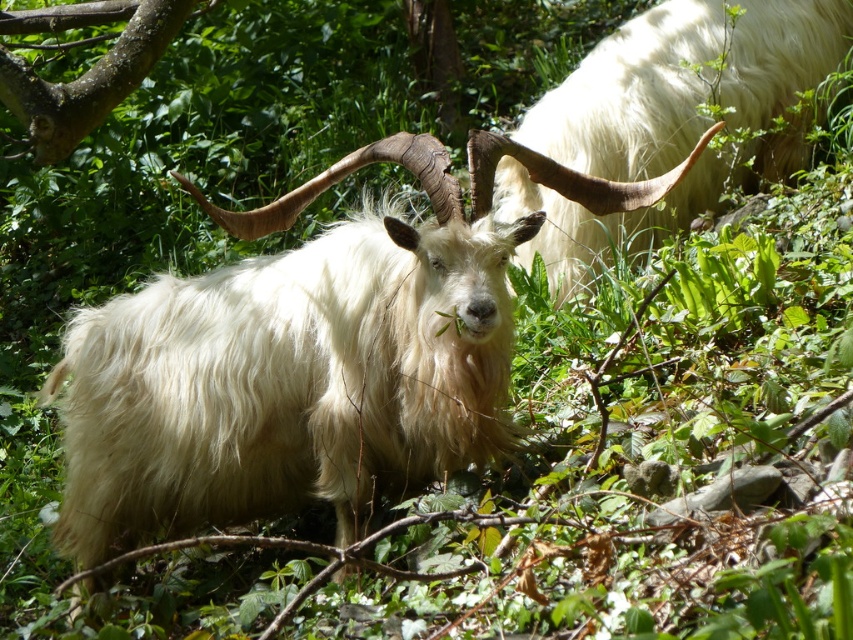
Question: Which is nearer to the white woolly goat at upper right?

Choices:
 (A) white woolen goat at center
 (B) brown rough bark at upper left

Answer: (A)

Question: Does white woolly goat at upper right appear over brown rough bark at upper left?

Choices:
 (A) yes
 (B) no

Answer: (B)

Question: Can you confirm if white woolen goat at center is smaller than brown rough bark at upper left?

Choices:
 (A) no
 (B) yes

Answer: (A)

Question: Which object is closer to the camera taking this photo?

Choices:
 (A) brown rough bark at upper left
 (B) white woolly goat at upper right

Answer: (A)

Question: Can you confirm if white woolly goat at upper right is positioned to the right of brown rough bark at upper left?

Choices:
 (A) yes
 (B) no

Answer: (A)

Question: Which object is positioned closest to the white woolen goat at center?

Choices:
 (A) brown rough bark at upper left
 (B) white woolly goat at upper right

Answer: (A)